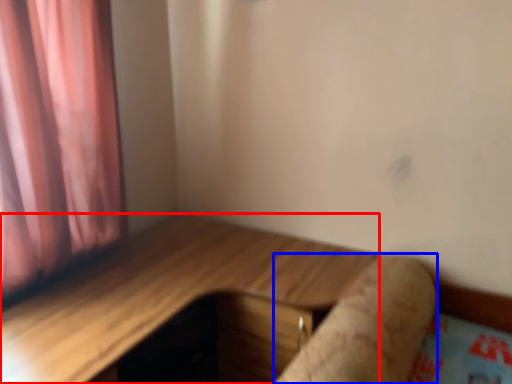
Question: Among these objects, which one is farthest to the camera, table (highlighted by a red box) or log (highlighted by a blue box)?

Choices:
 (A) table
 (B) log

Answer: (B)